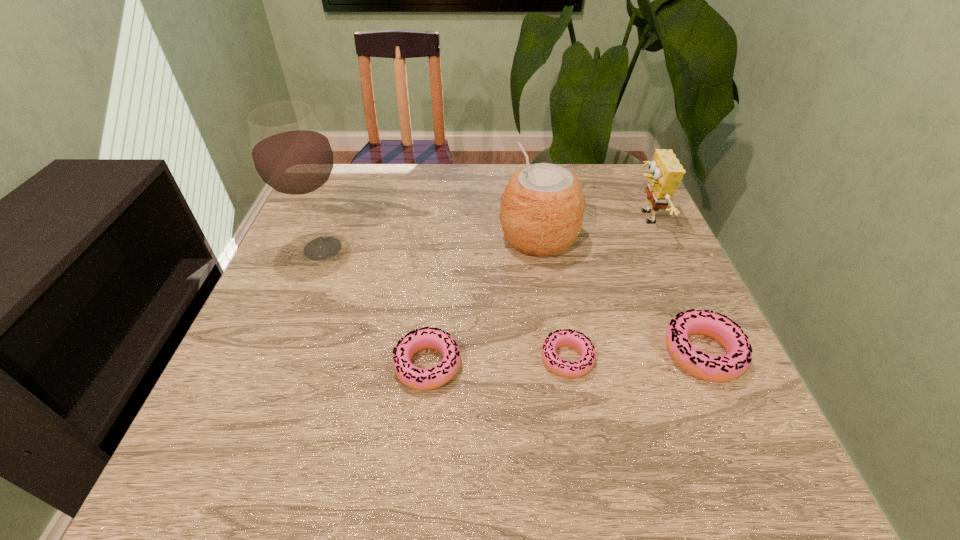
This screenshot has height=540, width=960. Find the location of `vacant area that lies between the coconut and the second tallest doughnut`. vacant area that lies between the coconut and the second tallest doughnut is located at coordinates (483, 302).

Locate an element on the screen. the fourth closest object to the leftmost object is located at coordinates (723, 368).

Choose which object is the second nearest neighbor to the leftmost object. Please provide its 2D coordinates. Your answer should be formatted as a tuple, i.e. [(x, y)], where the tuple contains the x and y coordinates of a point satisfying the conditions above.

[(542, 207)]

Identify which doughnut is the third closest to the second tallest object. Please provide its 2D coordinates. Your answer should be formatted as a tuple, i.e. [(x, y)], where the tuple contains the x and y coordinates of a point satisfying the conditions above.

[(413, 377)]

Identify which doughnut is the nearest to the shortest doughnut. Please provide its 2D coordinates. Your answer should be formatted as a tuple, i.e. [(x, y)], where the tuple contains the x and y coordinates of a point satisfying the conditions above.

[(723, 368)]

Where is `free space that satisfies the following two spatial constraints: 1. on the face of the third tallest object; 2. on the front side of the alcohol`? free space that satisfies the following two spatial constraints: 1. on the face of the third tallest object; 2. on the front side of the alcohol is located at coordinates (660, 248).

The height and width of the screenshot is (540, 960). Identify the location of blank area in the image that satisfies the following two spatial constraints: 1. on the front side of the leftmost object; 2. on the left side of the fourth tallest object. (281, 353).

Locate an element on the screen. free space that satisfies the following two spatial constraints: 1. on the back side of the fifth shortest object; 2. on the left side of the second shortest object is located at coordinates click(x=441, y=238).

The height and width of the screenshot is (540, 960). I want to click on vacant area that satisfies the following two spatial constraints: 1. on the back side of the second shortest object; 2. on the left side of the tallest doughnut, so click(429, 353).